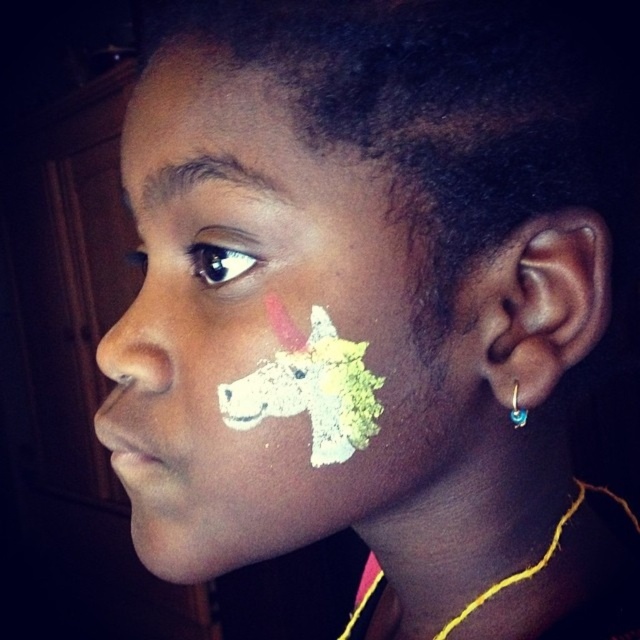
You are a makeup artist trying to apply a similar unicorn face painting. The client has a face size of 18 centimeters. If the distance between the white matte unicorn at center and the matte skin at upper left is 5.23 centimeters, will the unicorn fit proportionally on the client?

The white matte unicorn at center is 5.23 centimeters away from the matte skin at upper left. Given the client has a face size of 18 centimeters, the unicorn will fit proportionally as the distance between them is within a reasonable scale for facial features.

You are a makeup artist preparing to apply a new design on the person. You have two areas to consider for placement of a sticker decoration. The areas are the matte skin at upper left and the matte white nose at left. Which area is higher up on the face?

The matte skin at upper left is taller than the matte white nose at left, so the matte skin at upper left is higher up on the face.

You are an artist trying to paint a portrait of this person. You need to determine which of the two points, point (340, 474) or point (260, 74), is closer to the viewer. Which point should you focus on first?

Point (340, 474) is further to the viewer than point (260, 74), so you should focus on point (260, 74) first since it is closer to the viewer.